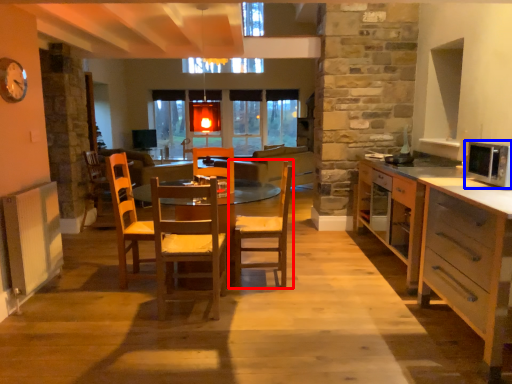
Question: Which object is closer to the camera taking this photo, chair (highlighted by a red box) or microwave oven (highlighted by a blue box)?

Choices:
 (A) chair
 (B) microwave oven

Answer: (B)